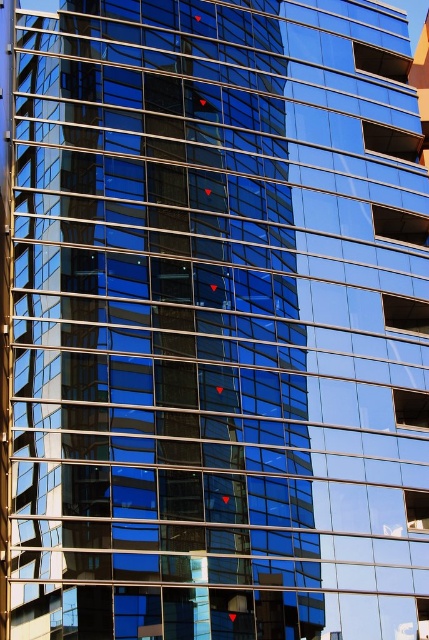
Does clear glass window at upper right have a greater width compared to clear glass window at center-right?

No, clear glass window at upper right is not wider than clear glass window at center-right.

Where is `clear glass window at upper right`? This screenshot has width=429, height=640. clear glass window at upper right is located at coordinates (380, 61).

Does transparent glass window at center appear on the left side of clear glass window at upper right?

In fact, transparent glass window at center is to the right of clear glass window at upper right.

Does point (402, 300) come closer to viewer compared to point (381, 52)?

Yes, it is in front of point (381, 52).

Does point (408, 332) come behind point (407, 80)?

No, it is not.

Locate an element on the screen. The width and height of the screenshot is (429, 640). transparent glass window at center is located at coordinates (404, 314).

Can you confirm if transparent glass window at right is wider than blue glass window at center?

No.

This screenshot has width=429, height=640. I want to click on transparent glass window at right, so click(399, 225).